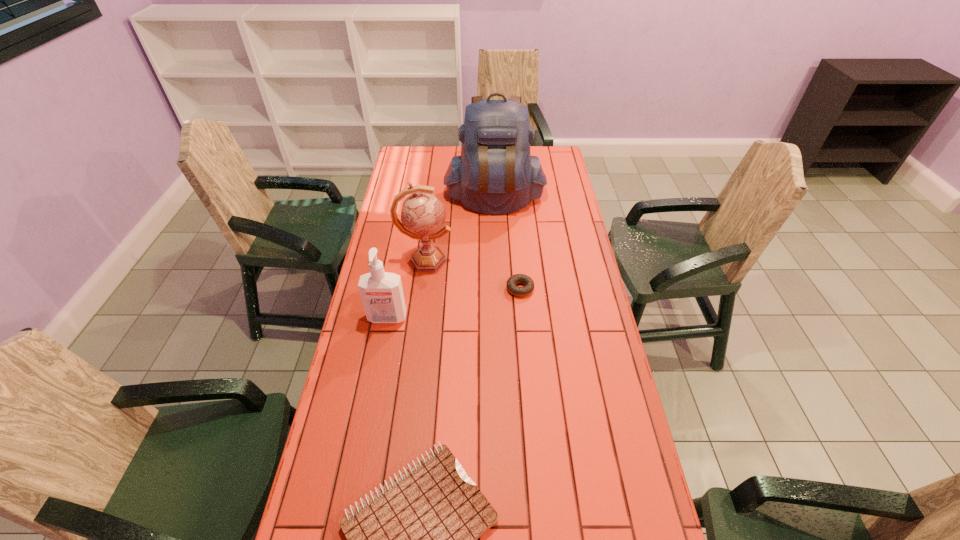
Locate an element on the screen. The width and height of the screenshot is (960, 540). globe located at the left edge is located at coordinates (422, 215).

Where is `cleansing agent at the left edge`? cleansing agent at the left edge is located at coordinates (381, 292).

Where is `object present at the right edge`? object present at the right edge is located at coordinates (495, 174).

The image size is (960, 540). I want to click on free space at the left edge of the desktop, so click(378, 485).

The image size is (960, 540). Find the location of `blank space at the right edge of the desktop`. blank space at the right edge of the desktop is located at coordinates (588, 426).

In order to click on unoccupied position between the third nearest object and the farthest object in this screenshot , I will do `click(508, 244)`.

Where is `vacant region between the cleansing agent and the third farthest object`? This screenshot has height=540, width=960. vacant region between the cleansing agent and the third farthest object is located at coordinates (454, 303).

Where is `free space between the doughnut and the cleansing agent`? free space between the doughnut and the cleansing agent is located at coordinates (454, 303).

Locate an element on the screen. free area in between the doughnut and the second nearest object is located at coordinates (454, 303).

Where is `vacant point located between the second nearest object and the third nearest object`? vacant point located between the second nearest object and the third nearest object is located at coordinates (454, 303).